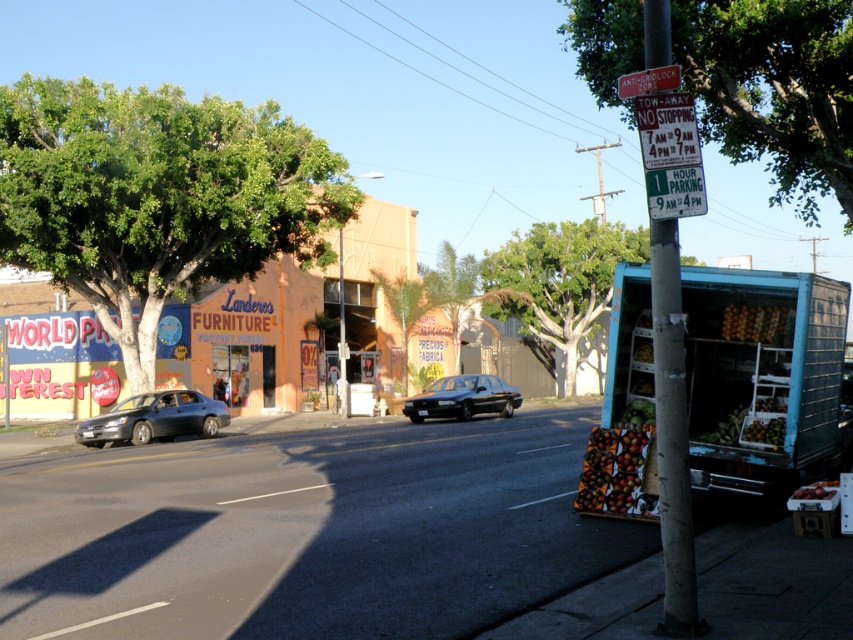
Does green leafy tree at right appear under green leafy palm tree at center?

Actually, green leafy tree at right is above green leafy palm tree at center.

Does point (569, 260) come in front of point (399, 292)?

Yes, it is in front of point (399, 292).

This screenshot has height=640, width=853. Find the location of `green leafy tree at right`. green leafy tree at right is located at coordinates (560, 280).

Consider the image. Is shiny black sedan at center shorter than brushed metal sign at upper center?

Correct, shiny black sedan at center is not as tall as brushed metal sign at upper center.

Who is more forward, [460,419] or [625,90]?

Point [625,90]

Between point (497, 388) and point (663, 68), which one is positioned in front?

Positioned in front is point (663, 68).

Identify the location of shiny black sedan at center. (463, 397).

Can you confirm if green leafy palm tree at center is taller than brushed metal sign at upper center?

Indeed, green leafy palm tree at center has a greater height compared to brushed metal sign at upper center.

Is point (399, 324) closer to viewer compared to point (645, 72)?

No, (399, 324) is behind (645, 72).

I want to click on green leafy palm tree at center, so click(405, 307).